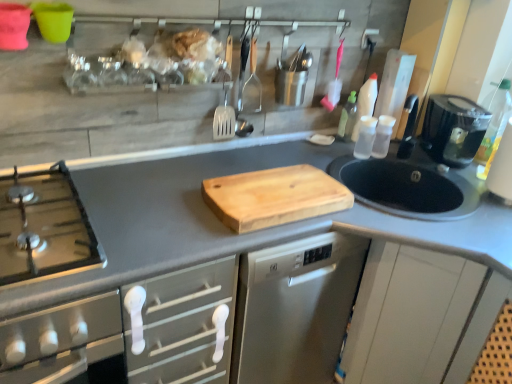
At what (x,y) coordinates should I click in order to perform the action: click on transparent plastic bottles at right, placed as the second bottle when sorted from left to right. Please return your answer as a coordinate pair (x, y). Looking at the image, I should click on (365, 137).

What is the approximate height of transparent plastic bottles at right, the 2th bottle viewed from the right?

6.45 inches.

You are a GUI agent. You are given a task and a screenshot of the screen. Output one action in this format:
    pyautogui.click(x=<x>, y=<y>)
    Task: Click on the transparent plastic bottle at right, the third bottle viewed from the left
    The width and height of the screenshot is (512, 384).
    Given the screenshot: What is the action you would take?
    pyautogui.click(x=495, y=124)

Where is `transparent plastic bottles at right, placed as the second bottle when sorted from left to right`? transparent plastic bottles at right, placed as the second bottle when sorted from left to right is located at coordinates (365, 137).

Would you say transparent plastic bottles at right, the 2th bottle viewed from the right, is outside natural wood cutting board at center?

Yes.

Does transparent plastic bottles at right, the 2th bottle viewed from the right, turn towards natural wood cutting board at center?

No, transparent plastic bottles at right, the 2th bottle viewed from the right, is not oriented towards natural wood cutting board at center.

How far apart are transparent plastic bottles at right, the 2th bottle viewed from the right, and natural wood cutting board at center?

transparent plastic bottles at right, the 2th bottle viewed from the right, is 20.70 inches from natural wood cutting board at center.

Can you confirm if transparent plastic bottles at right, the 2th bottle viewed from the right, is taller than natural wood cutting board at center?

Indeed, transparent plastic bottles at right, the 2th bottle viewed from the right, has a greater height compared to natural wood cutting board at center.

From the picture: How much distance is there between black plastic coffee maker at right and natural wood cutting board at center?

black plastic coffee maker at right is 27.88 inches away from natural wood cutting board at center.

Is point (475, 122) closer or farther from the camera than point (231, 177)?

Point (475, 122) appears to be farther away from the viewer than point (231, 177).

Which is behind, black plastic coffee maker at right or natural wood cutting board at center?

Positioned behind is black plastic coffee maker at right.

Is black plastic coffee maker at right next to natural wood cutting board at center?

black plastic coffee maker at right and natural wood cutting board at center are clearly separated.

From a real-world perspective, is black plastic coffee maker at right over transparent plastic bottle at right, the third bottle viewed from the left?

No, from a real-world perspective, black plastic coffee maker at right is not above transparent plastic bottle at right, the third bottle viewed from the left.

Is black plastic coffee maker at right not close to transparent plastic bottle at right, the first bottle positioned from the right?

No, there isn't a large distance between black plastic coffee maker at right and transparent plastic bottle at right, the first bottle positioned from the right.

Between black plastic coffee maker at right and transparent plastic bottle at right, the third bottle viewed from the left, which one has more height?

transparent plastic bottle at right, the third bottle viewed from the left.

Considering the relative positions of black plastic coffee maker at right and transparent plastic bottle at right, the first bottle positioned from the right, in the image provided, is black plastic coffee maker at right in front of transparent plastic bottle at right, the first bottle positioned from the right,?

Yes, black plastic coffee maker at right is closer to the camera.

Considering the positions of objects natural wood cutting board at center and transparent plastic bottles at right, placed as the second bottle when sorted from left to right, in the image provided, who is behind, natural wood cutting board at center or transparent plastic bottles at right, placed as the second bottle when sorted from left to right,?

transparent plastic bottles at right, placed as the second bottle when sorted from left to right.

Can you confirm if natural wood cutting board at center is wider than transparent plastic bottles at right, placed as the second bottle when sorted from left to right?

Yes, natural wood cutting board at center is wider than transparent plastic bottles at right, placed as the second bottle when sorted from left to right.

Which is in front, point (332, 187) or point (358, 137)?

The point (332, 187) is more forward.

Consider the image. What's the angular difference between black plastic coffee maker at right and transparent plastic bottle at upper right, which is the first bottle in left-to-right order,'s facing directions?

They differ by 89.7 degrees in their facing directions.

Who is bigger, black plastic coffee maker at right or transparent plastic bottle at upper right, which is the third bottle in right-to-left order?

With larger size is black plastic coffee maker at right.

Is black plastic coffee maker at right oriented away from transparent plastic bottle at upper right, which is the third bottle in right-to-left order?

No, black plastic coffee maker at right is not facing away from transparent plastic bottle at upper right, which is the third bottle in right-to-left order.

This screenshot has width=512, height=384. Find the location of `the 3rd bottle behind the black plastic coffee maker at right, counting from the anchor's position`. the 3rd bottle behind the black plastic coffee maker at right, counting from the anchor's position is located at coordinates (347, 119).

From a real-world perspective, is transparent plastic bottles at right, the 2th bottle viewed from the right, on black plastic coffee maker at right?

No, from a real-world perspective, transparent plastic bottles at right, the 2th bottle viewed from the right, is not on top of black plastic coffee maker at right.

Can we say transparent plastic bottles at right, the 2th bottle viewed from the right, lies outside black plastic coffee maker at right?

Yes, transparent plastic bottles at right, the 2th bottle viewed from the right, is outside of black plastic coffee maker at right.

How distant is transparent plastic bottles at right, the 2th bottle viewed from the right, from black plastic coffee maker at right?

transparent plastic bottles at right, the 2th bottle viewed from the right, and black plastic coffee maker at right are 12.57 inches apart from each other.

Considering the sizes of objects transparent plastic bottles at right, placed as the second bottle when sorted from left to right, and black plastic coffee maker at right in the image provided, who is taller, transparent plastic bottles at right, placed as the second bottle when sorted from left to right, or black plastic coffee maker at right?

With more height is black plastic coffee maker at right.

From the image's perspective, between transparent plastic bottles at right, the 2th bottle viewed from the right, and transparent plastic bottle at upper right, which is the first bottle in left-to-right order, which one is located above?

From the image's view, transparent plastic bottle at upper right, which is the first bottle in left-to-right order, is above.

Is point (373, 127) positioned in front of point (353, 105)?

Yes, point (373, 127) is in front of point (353, 105).

Is transparent plastic bottles at right, placed as the second bottle when sorted from left to right, to the left of transparent plastic bottle at upper right, which is the first bottle in left-to-right order, from the viewer's perspective?

No.

The image size is (512, 384). In order to click on cutting board that is under the transparent plastic bottles at right, the 2th bottle viewed from the right (from a real-world perspective) in this screenshot , I will do `click(274, 197)`.

The image size is (512, 384). I want to click on kitchen appliance above the natural wood cutting board at center (from the image's perspective), so click(x=453, y=129).

Based on their spatial positions, is transparent plastic bottle at upper right, which is the first bottle in left-to-right order, or natural wood cutting board at center closer to transparent plastic bottles at right, the 2th bottle viewed from the right?

Among the two, transparent plastic bottle at upper right, which is the first bottle in left-to-right order, is located nearer to transparent plastic bottles at right, the 2th bottle viewed from the right.

From the image, which object appears to be farther from natural wood cutting board at center, black plastic coffee maker at right or transparent plastic bottle at upper right, which is the third bottle in right-to-left order?

The object further to natural wood cutting board at center is black plastic coffee maker at right.

When comparing their distances from transparent plastic bottle at upper right, which is the first bottle in left-to-right order, does black plastic coffee maker at right or transparent plastic bottles at right, the 2th bottle viewed from the right, seem closer?

transparent plastic bottles at right, the 2th bottle viewed from the right, is closer to transparent plastic bottle at upper right, which is the first bottle in left-to-right order.

Considering their positions, is transparent plastic bottle at right, the third bottle viewed from the left, positioned further to transparent plastic bottles at right, placed as the second bottle when sorted from left to right, than natural wood cutting board at center?

natural wood cutting board at center is further to transparent plastic bottles at right, placed as the second bottle when sorted from left to right.

Looking at the image, which one is located further to transparent plastic bottle at upper right, which is the first bottle in left-to-right order, transparent plastic bottles at right, placed as the second bottle when sorted from left to right, or black plastic coffee maker at right?

black plastic coffee maker at right is positioned further to the anchor transparent plastic bottle at upper right, which is the first bottle in left-to-right order.

Based on their spatial positions, is transparent plastic bottle at upper right, which is the third bottle in right-to-left order, or black plastic coffee maker at right closer to transparent plastic bottles at right, placed as the second bottle when sorted from left to right?

Based on the image, transparent plastic bottle at upper right, which is the third bottle in right-to-left order, appears to be nearer to transparent plastic bottles at right, placed as the second bottle when sorted from left to right.

Considering their positions, is transparent plastic bottle at upper right, which is the first bottle in left-to-right order, positioned closer to black plastic coffee maker at right than transparent plastic bottles at right, the 2th bottle viewed from the right?

transparent plastic bottles at right, the 2th bottle viewed from the right.

When comparing their distances from transparent plastic bottles at right, placed as the second bottle when sorted from left to right, does black plastic coffee maker at right or natural wood cutting board at center seem closer?

black plastic coffee maker at right is closer to transparent plastic bottles at right, placed as the second bottle when sorted from left to right.

The width and height of the screenshot is (512, 384). Find the location of `kitchen appliance situated between natural wood cutting board at center and transparent plastic bottle at right, the third bottle viewed from the left, from left to right`. kitchen appliance situated between natural wood cutting board at center and transparent plastic bottle at right, the third bottle viewed from the left, from left to right is located at coordinates (453, 129).

Find the location of a particular element. kitchen appliance situated between transparent plastic bottle at upper right, which is the third bottle in right-to-left order, and transparent plastic bottle at right, the third bottle viewed from the left, from left to right is located at coordinates (453, 129).

At what (x,y) coordinates should I click in order to perform the action: click on bottle between transparent plastic bottle at upper right, which is the third bottle in right-to-left order, and black plastic coffee maker at right, in the horizontal direction. Please return your answer as a coordinate pair (x, y). Looking at the image, I should click on (365, 137).

The image size is (512, 384). Identify the location of bottle between transparent plastic bottle at upper right, which is the third bottle in right-to-left order, and transparent plastic bottle at right, the first bottle positioned from the right, in the horizontal direction. (365, 137).